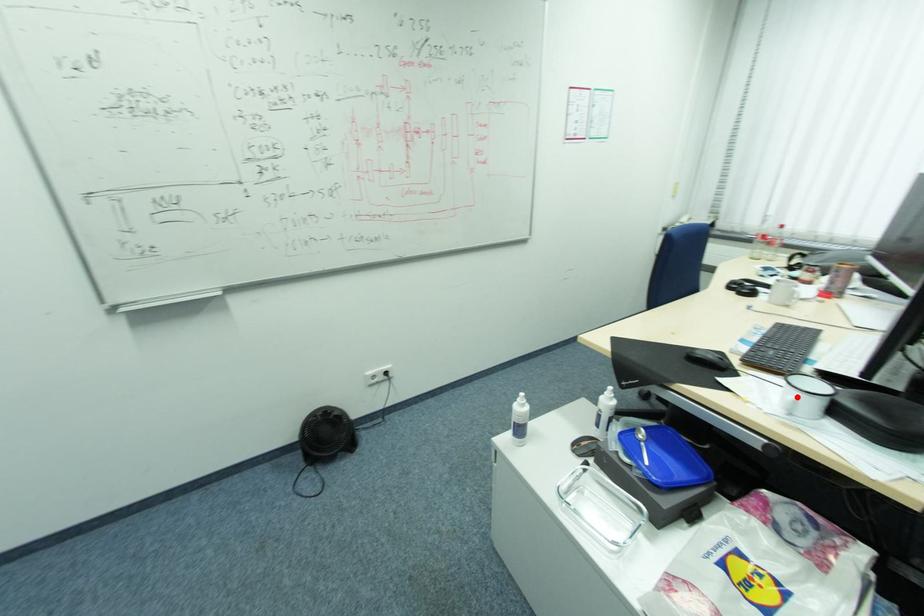
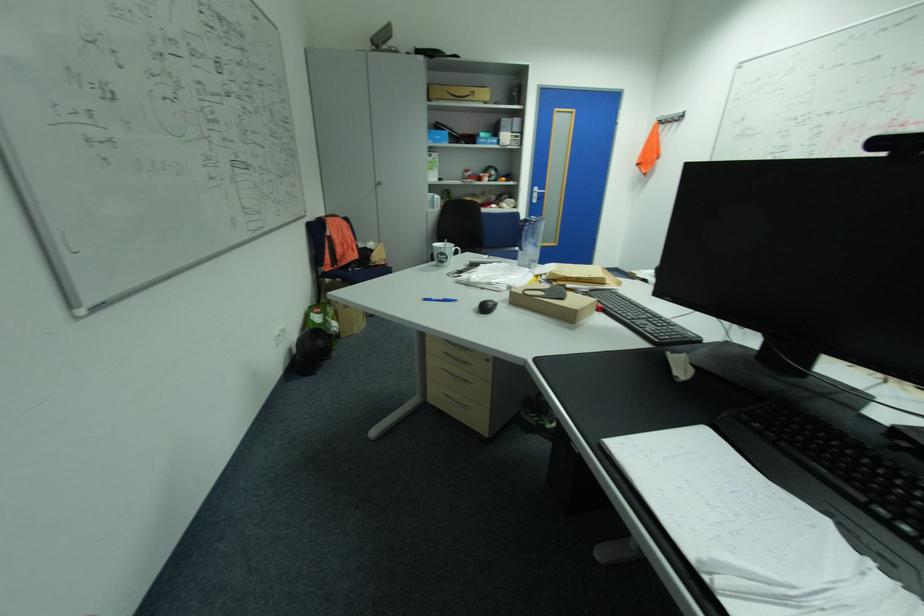
Question: I am providing you with two images of the same scene from different viewpoints. A red point is marked on the first image. Is the red point's position out of view in image 2?

Choices:
 (A) Yes
 (B) No

Answer: (A)